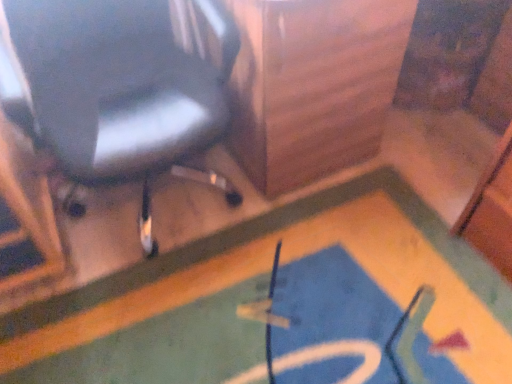
Question: Looking at the image, does matte black chair at upper left seem bigger or smaller compared to blue carpet at lower center?

Choices:
 (A) big
 (B) small

Answer: (A)

Question: In the image, is matte black chair at upper left on the left side or the right side of blue carpet at lower center?

Choices:
 (A) left
 (B) right

Answer: (A)

Question: In terms of width, does matte black chair at upper left look wider or thinner when compared to blue carpet at lower center?

Choices:
 (A) thin
 (B) wide

Answer: (A)

Question: From a real-world perspective, is blue carpet at lower center positioned above or below matte black chair at upper left?

Choices:
 (A) above
 (B) below

Answer: (B)

Question: Is blue carpet at lower center wider or thinner than matte black chair at upper left?

Choices:
 (A) wide
 (B) thin

Answer: (A)

Question: From the image's perspective, is blue carpet at lower center located above or below matte black chair at upper left?

Choices:
 (A) above
 (B) below

Answer: (B)

Question: Considering the positions of point (96, 304) and point (94, 105), is point (96, 304) closer or farther from the camera than point (94, 105)?

Choices:
 (A) farther
 (B) closer

Answer: (A)